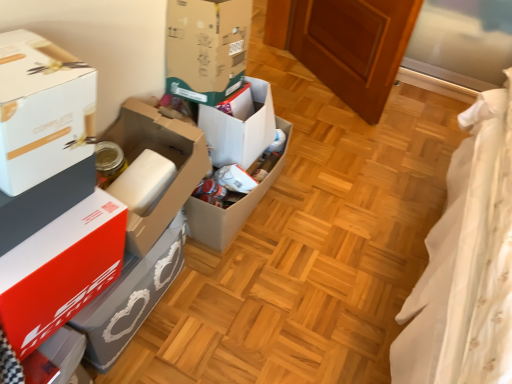
Find the location of a particular element. This screenshot has height=384, width=512. vacant area that is situated to the right of cardboard box at center, placed as the second box when sorted from back to front is located at coordinates (330, 211).